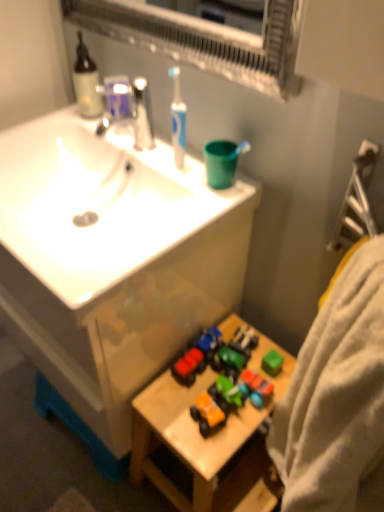
Describe the element at coordinates (86, 81) in the screenshot. The height and width of the screenshot is (512, 384). I see `translucent glass soap dispenser at upper left` at that location.

Describe the element at coordinates (256, 387) in the screenshot. I see `green matte toy car at lower center, acting as the 4th toy starting from the left` at that location.

How much space does green matte toy car at lower center, acting as the 4th toy starting from the left, occupy horizontally?

The width of green matte toy car at lower center, acting as the 4th toy starting from the left, is 6.24 centimeters.

What are the coordinates of `rubberized plastic toy car at center, which ranks as the second toy in right-to-left order` in the screenshot? It's located at (209, 339).

I want to click on white soft towel at right, so click(337, 398).

What do you see at coordinates (207, 413) in the screenshot? The height and width of the screenshot is (512, 384). I see `orange matte toy car at lower center, acting as the third toy starting from the right` at bounding box center [207, 413].

This screenshot has height=512, width=384. What are the coordinates of `white glossy sink at upper left` in the screenshot? It's located at (112, 260).

Locate an element on the screen. This screenshot has height=512, width=384. translucent glass soap dispenser at upper left is located at coordinates [86, 81].

From a real-world perspective, is matte silver faucet at upper center positioned under wooden toy at lower right based on gravity?

Actually, matte silver faucet at upper center is physically above wooden toy at lower right in the real world.

Considering the relative sizes of matte silver faucet at upper center and wooden toy at lower right in the image provided, is matte silver faucet at upper center taller than wooden toy at lower right?

No, matte silver faucet at upper center is not taller than wooden toy at lower right.

This screenshot has width=384, height=512. In order to click on tap behind the wooden toy at lower right in this screenshot , I will do `click(131, 106)`.

Is matte silver faucet at upper center in front of or behind rubberized plastic toy car at center, which ranks as the 3th toy in left-to-right order, in the image?

Clearly, matte silver faucet at upper center is in front of rubberized plastic toy car at center, which ranks as the 3th toy in left-to-right order.

Does matte silver faucet at upper center turn towards rubberized plastic toy car at center, which ranks as the second toy in right-to-left order?

No, matte silver faucet at upper center is not oriented towards rubberized plastic toy car at center, which ranks as the second toy in right-to-left order.

Considering the sizes of objects matte silver faucet at upper center and rubberized plastic toy car at center, which ranks as the 3th toy in left-to-right order, in the image provided, who is bigger, matte silver faucet at upper center or rubberized plastic toy car at center, which ranks as the 3th toy in left-to-right order,?

matte silver faucet at upper center is bigger.

From a real-world perspective, is matte silver faucet at upper center physically above rubberized plastic toy car at center, which ranks as the 3th toy in left-to-right order?

Yes, from a real-world perspective, matte silver faucet at upper center is over rubberized plastic toy car at center, which ranks as the 3th toy in left-to-right order

Which of these two, green matte toy car at lower center, acting as the 4th toy starting from the left, or translucent glass soap dispenser at upper left, is bigger?

translucent glass soap dispenser at upper left.

Considering the relative positions of green matte toy car at lower center, the first toy from the right, and translucent glass soap dispenser at upper left in the image provided, is green matte toy car at lower center, the first toy from the right, to the left or to the right of translucent glass soap dispenser at upper left?

Based on their positions, green matte toy car at lower center, the first toy from the right, is located to the right of translucent glass soap dispenser at upper left.

From the image's perspective, is green matte toy car at lower center, acting as the 4th toy starting from the left, over translucent glass soap dispenser at upper left?

No, from the image's perspective, green matte toy car at lower center, acting as the 4th toy starting from the left, is not above translucent glass soap dispenser at upper left.

Is green matte toy car at lower center, the first toy from the right, a part of orange matte toy car at lower center, which appears as the second toy when viewed from the left?

That's incorrect, green matte toy car at lower center, the first toy from the right, is not inside orange matte toy car at lower center, which appears as the second toy when viewed from the left.

Based on the photo, are orange matte toy car at lower center, acting as the third toy starting from the right, and green matte toy car at lower center, the first toy from the right, beside each other?

No, orange matte toy car at lower center, acting as the third toy starting from the right, is not beside green matte toy car at lower center, the first toy from the right.

Which is in front, point (192, 406) or point (254, 384)?

The point (192, 406) is in front.

How far apart are orange matte toy car at lower center, acting as the third toy starting from the right, and green matte toy car at lower center, acting as the 4th toy starting from the left?

They are 4.57 inches apart.

Is point (77, 83) more distant than point (132, 92)?

Yes, point (77, 83) is behind point (132, 92).

Can you confirm if translucent glass soap dispenser at upper left is positioned to the left of matte silver faucet at upper center?

Yes, translucent glass soap dispenser at upper left is to the left of matte silver faucet at upper center.

Which of these two, translucent glass soap dispenser at upper left or matte silver faucet at upper center, stands shorter?

matte silver faucet at upper center.

Does white glossy sink at upper left have a lesser width compared to white soft towel at right?

Incorrect, the width of white glossy sink at upper left is not less than that of white soft towel at right.

Based on their positions, is white glossy sink at upper left located to the left or right of white soft towel at right?

Clearly, white glossy sink at upper left is on the left of white soft towel at right in the image.

From a real-world perspective, which is physically above, matte plastic toy car at center, which appears as the first toy when viewed from the left, or rubberized plastic toy car at center, which ranks as the second toy in right-to-left order?

In real-world perspective, matte plastic toy car at center, which appears as the first toy when viewed from the left, is above.

Is matte plastic toy car at center, which appears as the first toy when viewed from the left, smaller than rubberized plastic toy car at center, which ranks as the second toy in right-to-left order?

Incorrect, matte plastic toy car at center, which appears as the first toy when viewed from the left, is not smaller in size than rubberized plastic toy car at center, which ranks as the second toy in right-to-left order.

Is matte plastic toy car at center, the fourth toy from the right, shorter than rubberized plastic toy car at center, which ranks as the 3th toy in left-to-right order?

In fact, matte plastic toy car at center, the fourth toy from the right, may be taller than rubberized plastic toy car at center, which ranks as the 3th toy in left-to-right order.

Is matte plastic toy car at center, which appears as the first toy when viewed from the left, surrounding rubberized plastic toy car at center, which ranks as the 3th toy in left-to-right order?

Actually, rubberized plastic toy car at center, which ranks as the 3th toy in left-to-right order, is outside matte plastic toy car at center, which appears as the first toy when viewed from the left.

Locate an element on the screen. tap above the wooden toy at lower right (from a real-world perspective) is located at coordinates (131, 106).

Locate an element on the screen. Image resolution: width=384 pixels, height=512 pixels. the 4th toy behind the matte silver faucet at upper center, starting your count from the anchor is located at coordinates (209, 339).

Based on the photo, based on their spatial positions, is wooden toy at lower right or orange matte toy car at lower center, which appears as the second toy when viewed from the left, further from matte silver faucet at upper center?

The object further to matte silver faucet at upper center is wooden toy at lower right.

From the image, which object appears to be farther from white soft towel at right, wooden toy at lower right or matte plastic toy car at center, which appears as the first toy when viewed from the left?

matte plastic toy car at center, which appears as the first toy when viewed from the left, is positioned further to the anchor white soft towel at right.

Which object lies nearer to the anchor point white glossy sink at upper left, white soft towel at right or orange matte toy car at lower center, which appears as the second toy when viewed from the left?

orange matte toy car at lower center, which appears as the second toy when viewed from the left, is positioned closer to the anchor white glossy sink at upper left.

From the image, which object appears to be nearer to green matte toy car at lower center, acting as the 4th toy starting from the left, white soft towel at right or rubberized plastic toy car at center, which ranks as the second toy in right-to-left order?

Based on the image, rubberized plastic toy car at center, which ranks as the second toy in right-to-left order, appears to be nearer to green matte toy car at lower center, acting as the 4th toy starting from the left.

When comparing their distances from white soft towel at right, does rubberized plastic toy car at center, which ranks as the 3th toy in left-to-right order, or wooden toy at lower right seem further?

Among the two, rubberized plastic toy car at center, which ranks as the 3th toy in left-to-right order, is located further to white soft towel at right.

In the scene shown: Which object lies nearer to the anchor point translucent glass soap dispenser at upper left, green matte toy car at lower center, the first toy from the right, or wooden toy at lower right?

green matte toy car at lower center, the first toy from the right, lies closer to translucent glass soap dispenser at upper left than the other object.

Which object lies further to the anchor point wooden toy at lower right, rubberized plastic toy car at center, which ranks as the 3th toy in left-to-right order, or green matte toy car at lower center, the first toy from the right?

Based on the image, rubberized plastic toy car at center, which ranks as the 3th toy in left-to-right order, appears to be further to wooden toy at lower right.

Estimate the real-world distances between objects in this image. Which object is closer to white glossy sink at upper left, matte plastic toy car at center, the fourth toy from the right, or translucent glass soap dispenser at upper left?

The object closer to white glossy sink at upper left is matte plastic toy car at center, the fourth toy from the right.

You are a GUI agent. You are given a task and a screenshot of the screen. Output one action in this format:
    pyautogui.click(x=<x>, y=<y>)
    Task: Click on the sink between matte silver faucet at upper center and orange matte toy car at lower center, which appears as the second toy when viewed from the left, in the vertical direction
    This screenshot has height=512, width=384.
    Given the screenshot: What is the action you would take?
    pyautogui.click(x=112, y=260)

Find the location of a particular element. The image size is (384, 512). table between white glossy sink at upper left and green matte toy car at lower center, acting as the 4th toy starting from the left, from left to right is located at coordinates (207, 441).

Find the location of a particular element. sink between matte silver faucet at upper center and green matte toy car at lower center, the first toy from the right, from top to bottom is located at coordinates (112, 260).

In order to click on toy between translucent glass soap dispenser at upper left and matte plastic toy car at center, the fourth toy from the right, in the up-down direction in this screenshot , I will do `click(209, 339)`.